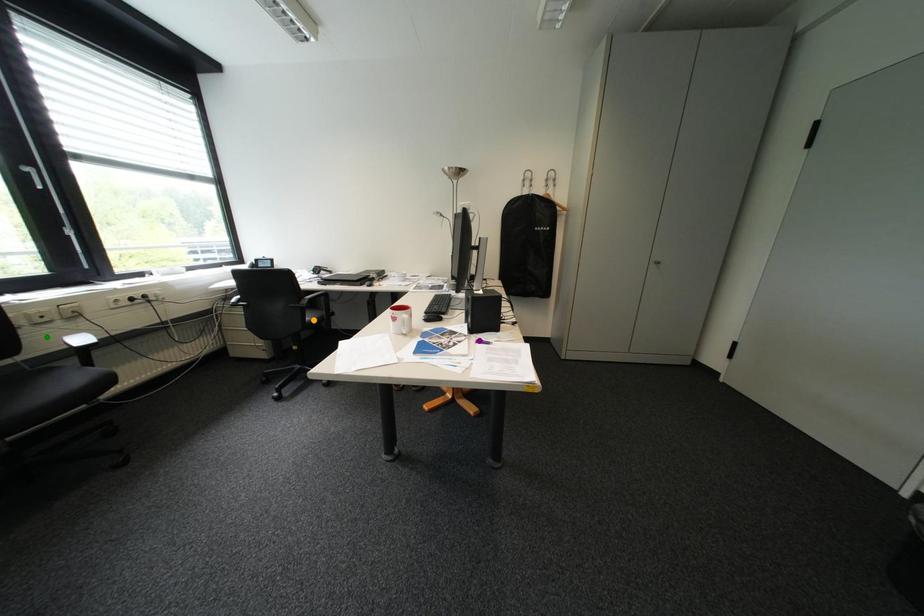
Order these from farthest to nearest:
orange point
green point
purple point

orange point → purple point → green point